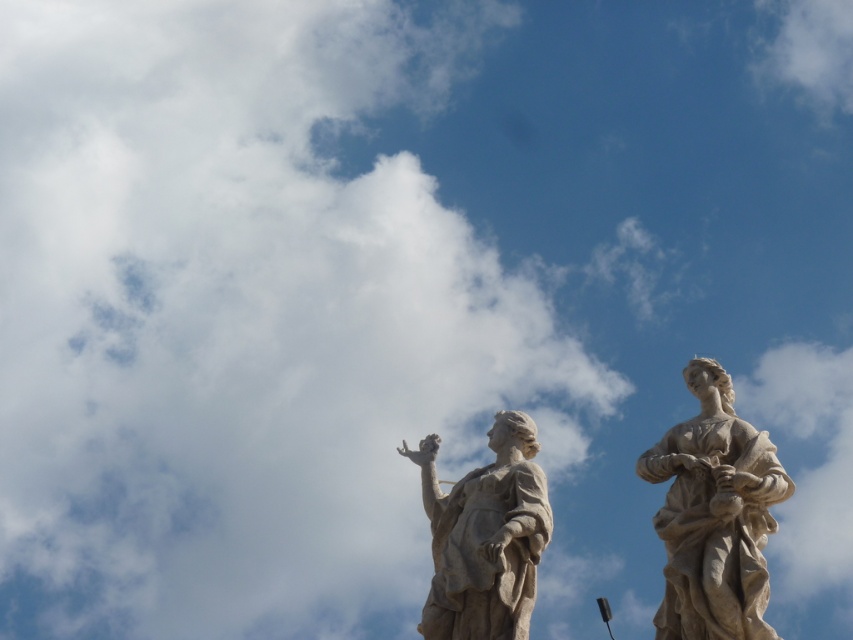
Question: In this image, where is white marble statue at right located relative to white marble statue at center?

Choices:
 (A) right
 (B) left

Answer: (A)

Question: Which of the following is the closest to the observer?

Choices:
 (A) white marble statue at center
 (B) white marble statue at right

Answer: (B)

Question: Among these points, which one is farthest from the camera?

Choices:
 (A) (492, 589)
 (B) (762, 572)

Answer: (A)

Question: Considering the relative positions of white marble statue at right and white marble statue at center in the image provided, where is white marble statue at right located with respect to white marble statue at center?

Choices:
 (A) left
 (B) right

Answer: (B)

Question: Can you confirm if white marble statue at right is positioned below white marble statue at center?

Choices:
 (A) yes
 (B) no

Answer: (B)